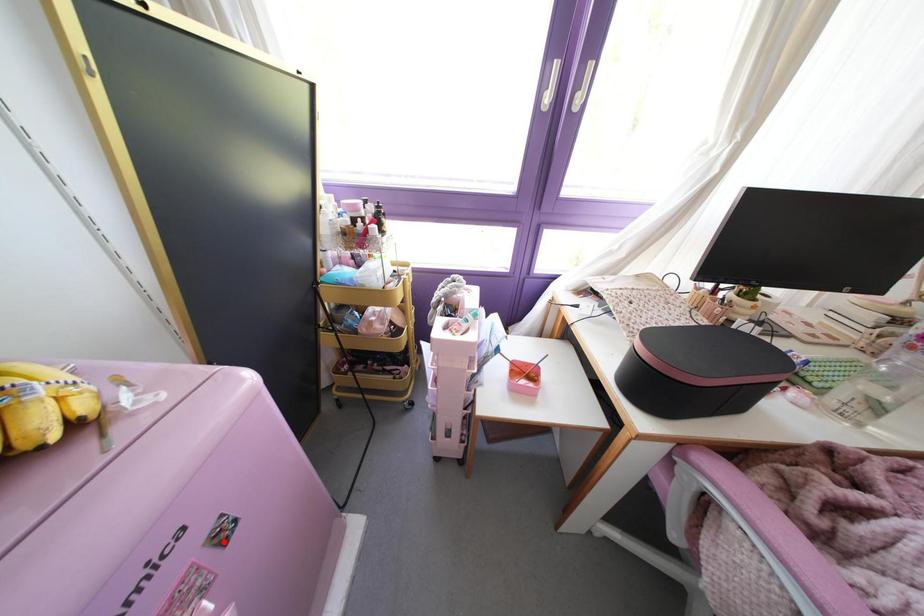
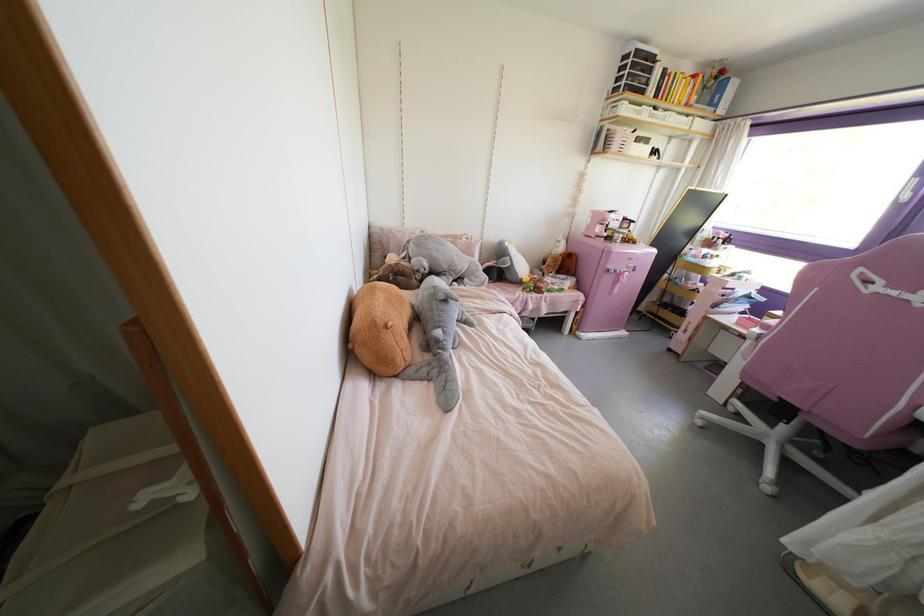
The point at the highlighted location is marked in the first image. Where is the corresponding point in the second image?

(633, 270)